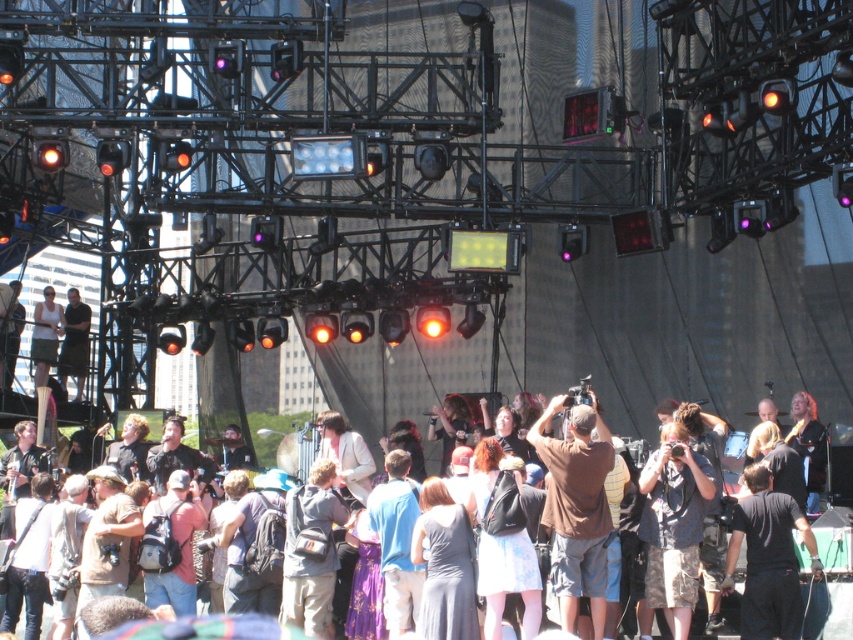
Question: Can you confirm if multicolored casual clothing at center is positioned to the left of matte black camera at center?

Choices:
 (A) yes
 (B) no

Answer: (B)

Question: Estimate the real-world distances between objects in this image. Which object is farther from the matte black camera at center?

Choices:
 (A) dark gray shirt at center
 (B) black cotton shirt at center
 (C) matte white tank top at center
 (D) multicolored casual clothing at center

Answer: (B)

Question: Estimate the real-world distances between objects in this image. Which object is closer to the matte white tank top at center?

Choices:
 (A) matte black camera at center
 (B) brown cotton t-shirt at center
 (C) multicolored casual clothing at center

Answer: (A)

Question: Which object is farther from the camera taking this photo?

Choices:
 (A) matte white tank top at center
 (B) matte black camera at center
 (C) camo shorts at center
 (D) brown cotton t-shirt at center

Answer: (A)

Question: Is brown cotton t-shirt at center thinner than camo shorts at center?

Choices:
 (A) no
 (B) yes

Answer: (A)

Question: Considering the relative positions of camo shorts at center and multicolored casual clothing at center in the image provided, where is camo shorts at center located with respect to multicolored casual clothing at center?

Choices:
 (A) right
 (B) left

Answer: (A)